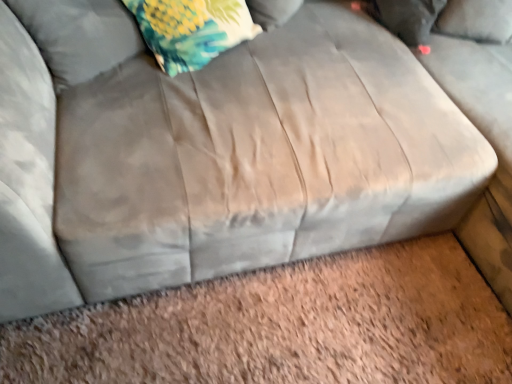
Describe the element at coordinates (191, 30) in the screenshot. I see `floral fabric pillow at upper left` at that location.

The height and width of the screenshot is (384, 512). What are the coordinates of `floral fabric pillow at upper left` in the screenshot? It's located at (191, 30).

Identify the location of floral fabric pillow at upper left, the 1th pillow from the right. (476, 20).

Describe the element at coordinates (79, 36) in the screenshot. I see `fluffy fabric pillow at upper left, which appears as the first pillow when viewed from the front` at that location.

I want to click on floral fabric pillow at upper left, so click(191, 30).

Is floral fabric pillow at upper left facing towards fluffy fabric pillow at upper left, positioned as the second pillow in right-to-left order?

No.

Which object is further away from the camera, floral fabric pillow at upper left or fluffy fabric pillow at upper left, the 2th pillow from the back?

floral fabric pillow at upper left is behind.

Do you think floral fabric pillow at upper left is within fluffy fabric pillow at upper left, positioned as the second pillow in right-to-left order, or outside of it?

floral fabric pillow at upper left cannot be found inside fluffy fabric pillow at upper left, positioned as the second pillow in right-to-left order.

Considering the relative sizes of floral fabric pillow at upper left and fluffy fabric pillow at upper left, the 2th pillow from the back, in the image provided, is floral fabric pillow at upper left shorter than fluffy fabric pillow at upper left, the 2th pillow from the back,?

No, floral fabric pillow at upper left is not shorter than fluffy fabric pillow at upper left, the 2th pillow from the back.

Considering the sizes of objects floral fabric pillow at upper left and floral fabric pillow at upper left, placed as the 1th pillow when sorted from back to front, in the image provided, who is bigger, floral fabric pillow at upper left or floral fabric pillow at upper left, placed as the 1th pillow when sorted from back to front,?

With larger size is floral fabric pillow at upper left.

From the image's perspective, does floral fabric pillow at upper left appear lower than floral fabric pillow at upper left, positioned as the 2th pillow in front-to-back order?

Yes, from the image's perspective, floral fabric pillow at upper left is beneath floral fabric pillow at upper left, positioned as the 2th pillow in front-to-back order.

I want to click on throw pillow below the floral fabric pillow at upper left, placed as the 1th pillow when sorted from back to front (from the image's perspective), so click(x=191, y=30).

Between point (191, 11) and point (509, 38), which one is positioned in front?

The point (191, 11) is in front.

In terms of height, does floral fabric pillow at upper left, placed as the 1th pillow when sorted from back to front, look taller or shorter compared to fluffy fabric pillow at upper left, positioned as the second pillow in right-to-left order?

Considering their sizes, floral fabric pillow at upper left, placed as the 1th pillow when sorted from back to front, has less height than fluffy fabric pillow at upper left, positioned as the second pillow in right-to-left order.

Is floral fabric pillow at upper left, placed as the 1th pillow when sorted from back to front, smaller than fluffy fabric pillow at upper left, the 2th pillow from the back?

Correct, floral fabric pillow at upper left, placed as the 1th pillow when sorted from back to front, occupies less space than fluffy fabric pillow at upper left, the 2th pillow from the back.

From the image's perspective, is floral fabric pillow at upper left, marked as the second pillow in a left-to-right arrangement, over fluffy fabric pillow at upper left, the 2th pillow from the back?

Yes, from the image's perspective, floral fabric pillow at upper left, marked as the second pillow in a left-to-right arrangement, is above fluffy fabric pillow at upper left, the 2th pillow from the back.

Can you confirm if floral fabric pillow at upper left, positioned as the 2th pillow in front-to-back order, is wider than fluffy fabric pillow at upper left, the 2th pillow from the back?

No, floral fabric pillow at upper left, positioned as the 2th pillow in front-to-back order, is not wider than fluffy fabric pillow at upper left, the 2th pillow from the back.

Is floral fabric pillow at upper left, the 1th pillow from the right, touching floral fabric pillow at upper left?

No, floral fabric pillow at upper left, the 1th pillow from the right, is not touching floral fabric pillow at upper left.

Consider the image. Could you measure the distance between floral fabric pillow at upper left, the 1th pillow from the right, and floral fabric pillow at upper left?

floral fabric pillow at upper left, the 1th pillow from the right, and floral fabric pillow at upper left are 37.50 inches apart from each other.

From a real-world perspective, which is physically below, floral fabric pillow at upper left, marked as the second pillow in a left-to-right arrangement, or floral fabric pillow at upper left?

floral fabric pillow at upper left, marked as the second pillow in a left-to-right arrangement.

Is floral fabric pillow at upper left, the 1th pillow from the right, spatially inside floral fabric pillow at upper left, or outside of it?

floral fabric pillow at upper left, the 1th pillow from the right, exists outside the volume of floral fabric pillow at upper left.

Is fluffy fabric pillow at upper left, which appears as the first pillow when viewed from the front, taller than floral fabric pillow at upper left?

No, fluffy fabric pillow at upper left, which appears as the first pillow when viewed from the front, is not taller than floral fabric pillow at upper left.

Is there a large distance between fluffy fabric pillow at upper left, positioned as the second pillow in right-to-left order, and floral fabric pillow at upper left?

No, fluffy fabric pillow at upper left, positioned as the second pillow in right-to-left order, is in close proximity to floral fabric pillow at upper left.

Can you tell me how much fluffy fabric pillow at upper left, positioned as the second pillow in right-to-left order, and floral fabric pillow at upper left differ in facing direction?

They differ by 9.57e-05 degrees in their facing directions.

Consider the image. Does fluffy fabric pillow at upper left, the 2th pillow from the back, appear on the left side of floral fabric pillow at upper left, the 1th pillow from the right?

Indeed, fluffy fabric pillow at upper left, the 2th pillow from the back, is positioned on the left side of floral fabric pillow at upper left, the 1th pillow from the right.

Considering the sizes of fluffy fabric pillow at upper left, positioned as the second pillow in right-to-left order, and floral fabric pillow at upper left, placed as the 1th pillow when sorted from back to front, in the image, is fluffy fabric pillow at upper left, positioned as the second pillow in right-to-left order, wider or thinner than floral fabric pillow at upper left, placed as the 1th pillow when sorted from back to front,?

fluffy fabric pillow at upper left, positioned as the second pillow in right-to-left order, is wider than floral fabric pillow at upper left, placed as the 1th pillow when sorted from back to front.

Is fluffy fabric pillow at upper left, the 1th pillow positioned from the left, directly adjacent to floral fabric pillow at upper left, the 1th pillow from the right?

No, fluffy fabric pillow at upper left, the 1th pillow positioned from the left, is not beside floral fabric pillow at upper left, the 1th pillow from the right.

Is floral fabric pillow at upper left, placed as the 1th pillow when sorted from back to front, at the back of fluffy fabric pillow at upper left, which appears as the first pillow when viewed from the front?

fluffy fabric pillow at upper left, which appears as the first pillow when viewed from the front, is not turned away from floral fabric pillow at upper left, placed as the 1th pillow when sorted from back to front.

Locate an element on the screen. throw pillow that appears behind the fluffy fabric pillow at upper left, the 1th pillow positioned from the left is located at coordinates tap(191, 30).

Find the location of a particular element. pillow above the floral fabric pillow at upper left (from the image's perspective) is located at coordinates (476, 20).

Looking at this image, estimate the real-world distances between objects in this image. Which object is closer to fluffy fabric pillow at upper left, the 2th pillow from the back, floral fabric pillow at upper left or floral fabric pillow at upper left, marked as the second pillow in a left-to-right arrangement?

floral fabric pillow at upper left.

Which object lies nearer to the anchor point floral fabric pillow at upper left, floral fabric pillow at upper left, marked as the second pillow in a left-to-right arrangement, or fluffy fabric pillow at upper left, the 2th pillow from the back?

fluffy fabric pillow at upper left, the 2th pillow from the back, lies closer to floral fabric pillow at upper left than the other object.

Looking at the image, which one is located further to floral fabric pillow at upper left, fluffy fabric pillow at upper left, the 1th pillow positioned from the left, or floral fabric pillow at upper left, positioned as the 2th pillow in front-to-back order?

Among the two, floral fabric pillow at upper left, positioned as the 2th pillow in front-to-back order, is located further to floral fabric pillow at upper left.

Estimate the real-world distances between objects in this image. Which object is closer to fluffy fabric pillow at upper left, which appears as the first pillow when viewed from the front, floral fabric pillow at upper left, placed as the 1th pillow when sorted from back to front, or floral fabric pillow at upper left?

floral fabric pillow at upper left is closer to fluffy fabric pillow at upper left, which appears as the first pillow when viewed from the front.

Which object lies further to the anchor point floral fabric pillow at upper left, marked as the second pillow in a left-to-right arrangement, fluffy fabric pillow at upper left, the 1th pillow positioned from the left, or floral fabric pillow at upper left?

fluffy fabric pillow at upper left, the 1th pillow positioned from the left, is positioned further to the anchor floral fabric pillow at upper left, marked as the second pillow in a left-to-right arrangement.

Which object lies nearer to the anchor point floral fabric pillow at upper left, positioned as the 2th pillow in front-to-back order, floral fabric pillow at upper left or fluffy fabric pillow at upper left, positioned as the second pillow in right-to-left order?

floral fabric pillow at upper left is positioned closer to the anchor floral fabric pillow at upper left, positioned as the 2th pillow in front-to-back order.

Image resolution: width=512 pixels, height=384 pixels. Identify the location of throw pillow located between fluffy fabric pillow at upper left, positioned as the second pillow in right-to-left order, and floral fabric pillow at upper left, placed as the 1th pillow when sorted from back to front, in the left-right direction. (191, 30).